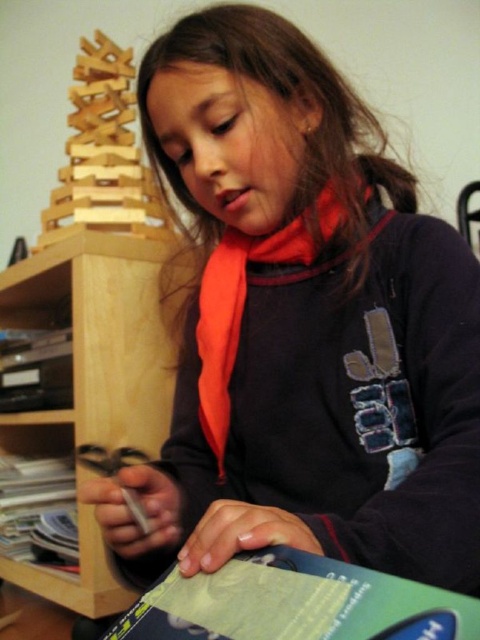
Does wooden blocks at upper left appear over green matte book at lower left?

Indeed, wooden blocks at upper left is positioned over green matte book at lower left.

Is point (133, 228) positioned after point (13, 486)?

No.

Between point (144, 182) and point (11, 506), which one is positioned behind?

The point (11, 506) is behind.

Find the location of a particular element. wooden blocks at upper left is located at coordinates (103, 154).

Can you confirm if wooden bookshelf at left is smaller than wooden blocks at upper left?

Actually, wooden bookshelf at left might be larger than wooden blocks at upper left.

Is the position of wooden bookshelf at left more distant than that of wooden blocks at upper left?

That is False.

Locate an element on the screen. The width and height of the screenshot is (480, 640). wooden bookshelf at left is located at coordinates (99, 339).

Measure the distance from wooden bookshelf at left to green matte book at lower left.

wooden bookshelf at left is 8.22 inches away from green matte book at lower left.

Does point (130, 301) come in front of point (4, 528)?

Yes, it is in front of point (4, 528).

Describe the element at coordinates (99, 339) in the screenshot. I see `wooden bookshelf at left` at that location.

Locate an element on the screen. The image size is (480, 640). wooden bookshelf at left is located at coordinates (99, 339).